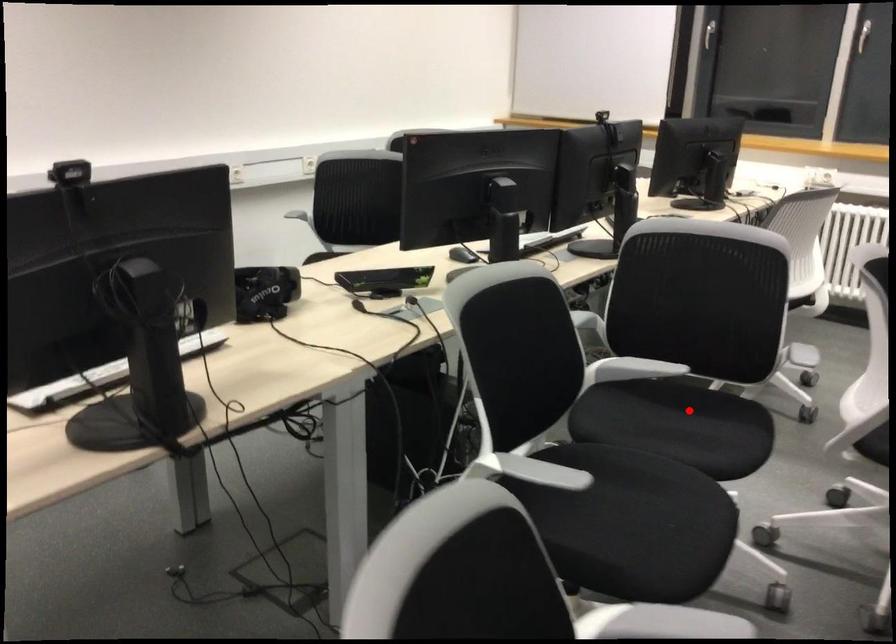
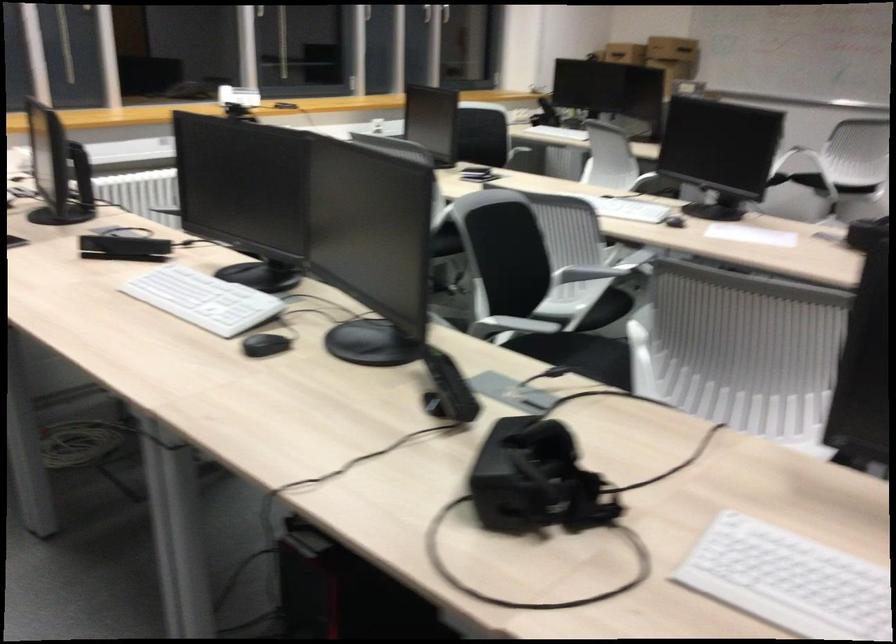
Question: A red point is marked in image1. In image2, is the corresponding 3D point closer to the camera or farther? Reply with the corresponding letter.

Choices:
 (A) The corresponding 3D point is closer.
 (B) The corresponding 3D point is farther.

Answer: (B)